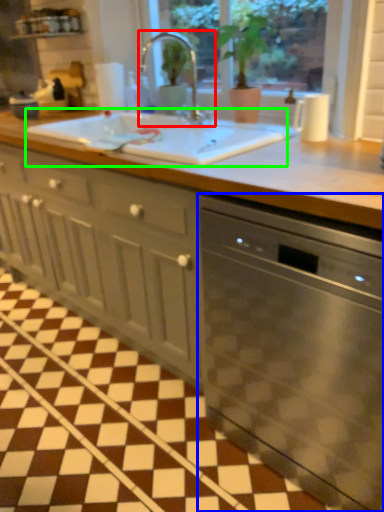
Question: Estimate the real-world distances between objects in this image. Which object is farther from tap (highlighted by a red box), home appliance (highlighted by a blue box) or sink (highlighted by a green box)?

Choices:
 (A) home appliance
 (B) sink

Answer: (A)